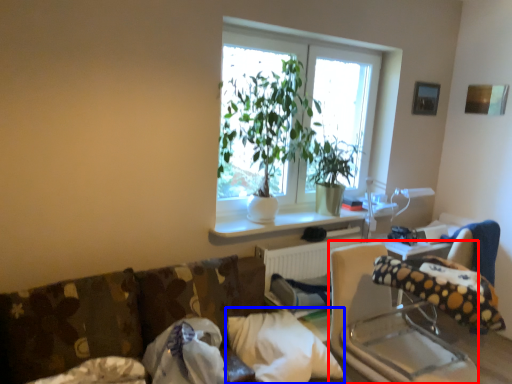
Question: Among these objects, which one is nearest to the camera, rocking chair (highlighted by a red box) or pillow (highlighted by a blue box)?

Choices:
 (A) rocking chair
 (B) pillow

Answer: (A)